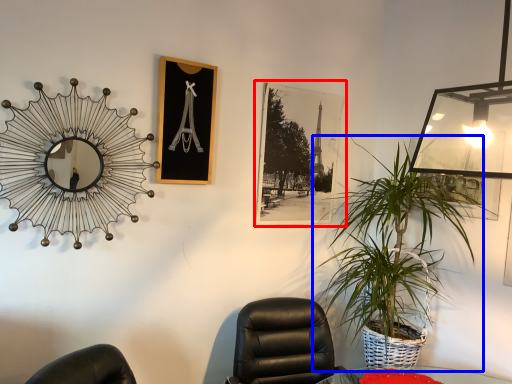
Question: Among these objects, which one is farthest to the camera, picture frame (highlighted by a red box) or houseplant (highlighted by a blue box)?

Choices:
 (A) picture frame
 (B) houseplant

Answer: (A)